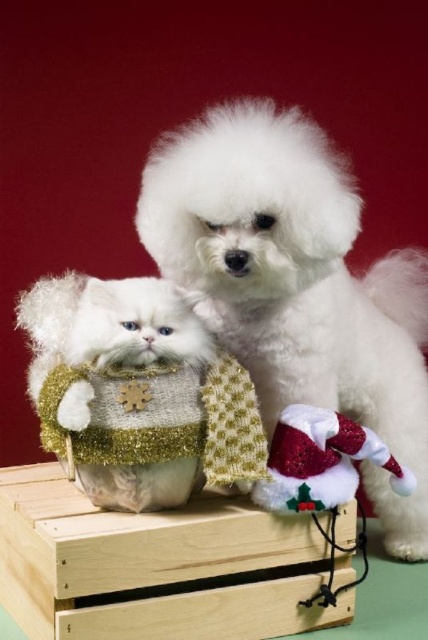
Question: Which object appears closest to the camera in this image?

Choices:
 (A) wooden crate at center
 (B) white fluffy dog at upper center

Answer: (A)

Question: Which of these objects is positioned farthest from the wooden crate at center?

Choices:
 (A) knitted gold and white sweater at center
 (B) sparkly red santa hat at lower right

Answer: (B)

Question: Estimate the real-world distances between objects in this image. Which object is farther from the white fluffy dog at upper center?

Choices:
 (A) wooden crate at center
 (B) sparkly red santa hat at lower right

Answer: (A)

Question: Can you confirm if white fluffy dog at upper center is positioned below sparkly red santa hat at lower right?

Choices:
 (A) no
 (B) yes

Answer: (A)

Question: Is white fluffy dog at upper center above wooden crate at center?

Choices:
 (A) yes
 (B) no

Answer: (A)

Question: Considering the relative positions of wooden crate at center and sparkly red santa hat at lower right in the image provided, where is wooden crate at center located with respect to sparkly red santa hat at lower right?

Choices:
 (A) right
 (B) left

Answer: (B)